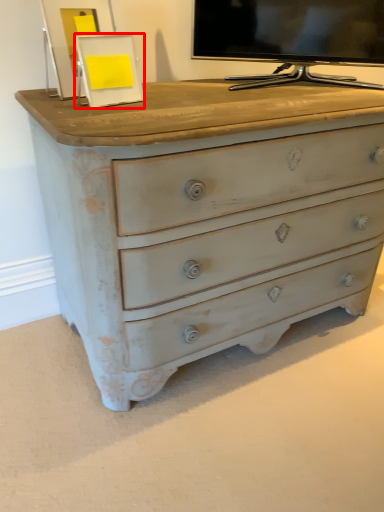
Question: From the image's perspective, what is the correct spatial relationship of picture frame (annotated by the red box) in relation to television?

Choices:
 (A) above
 (B) below

Answer: (B)